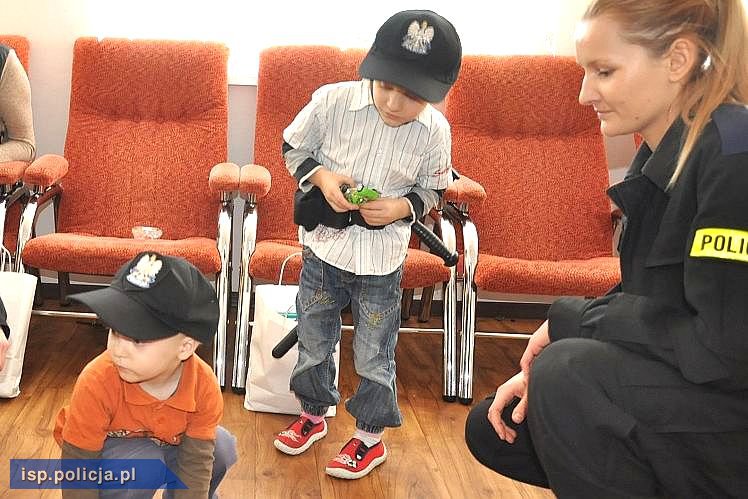
In order to click on place to sit in this screenshot , I will do [x=162, y=231], [x=272, y=217], [x=545, y=219].